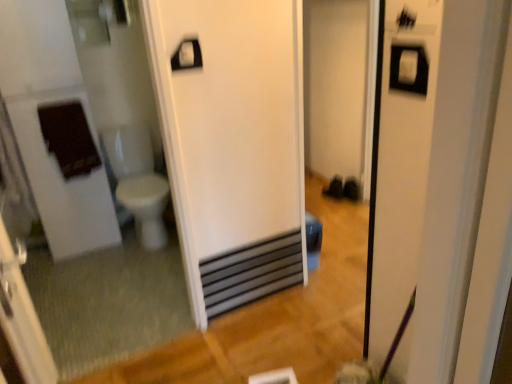
Question: From the image's perspective, is transparent plastic screen door at left positioned above or below black metallic water heater at center?

Choices:
 (A) below
 (B) above

Answer: (B)

Question: Choose the correct answer: Is transparent plastic screen door at left inside black metallic water heater at center or outside it?

Choices:
 (A) inside
 (B) outside

Answer: (B)

Question: Estimate the real-world distances between objects in this image. Which object is closer to the white glossy toilet bowl at left?

Choices:
 (A) white plastic towel bar at upper center
 (B) black metallic water heater at center
 (C) white glossy mirror at left
 (D) transparent plastic screen door at left

Answer: (C)

Question: Which object is positioned closest to the black metallic water heater at center?

Choices:
 (A) transparent plastic screen door at left
 (B) white plastic towel bar at upper center
 (C) white glossy toilet bowl at left
 (D) white glossy mirror at left

Answer: (D)